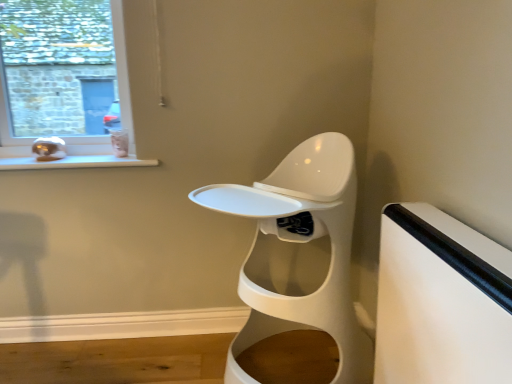
What is the approximate height of white glossy toilet at center?

white glossy toilet at center is 1.09 meters tall.

Measure the distance between point (337, 310) and camera.

Point (337, 310) and camera are 1.36 meters apart.

Image resolution: width=512 pixels, height=384 pixels. What do you see at coordinates (66, 84) in the screenshot?
I see `matte glass window at upper left` at bounding box center [66, 84].

Find the location of a particular element. The width and height of the screenshot is (512, 384). white glossy toilet at center is located at coordinates 298,253.

Measure the distance from white glossy window sill at lower left to white matte table at right.

white glossy window sill at lower left and white matte table at right are 3.68 feet apart.

Between white glossy window sill at lower left and white matte table at right, which one appears on the left side from the viewer's perspective?

Positioned to the left is white glossy window sill at lower left.

Is white glossy window sill at lower left inside the boundaries of white matte table at right, or outside?

white glossy window sill at lower left lies outside white matte table at right.

Can you tell me how much white glossy window sill at lower left and white matte table at right differ in facing direction?

The angle between the facing direction of white glossy window sill at lower left and the facing direction of white matte table at right is 89.7 degrees.

Where is `window above the white matte table at right (from the image's perspective)`? window above the white matte table at right (from the image's perspective) is located at coordinates (66, 84).

Which of these two, matte glass window at upper left or white matte table at right, stands taller?

With more height is matte glass window at upper left.

Is matte glass window at upper left bigger or smaller than white matte table at right?

Clearly, matte glass window at upper left is smaller in size than white matte table at right.

Considering the positions of objects white matte table at right and matte glass window at upper left in the image provided, who is more to the left, white matte table at right or matte glass window at upper left?

matte glass window at upper left is more to the left.

Is white matte table at right in front of or behind matte glass window at upper left in the image?

white matte table at right is in front of matte glass window at upper left.

Considering the positions of points (432, 274) and (24, 119), is point (432, 274) closer to camera compared to point (24, 119)?

Yes.

Is white matte table at right surrounding matte glass window at upper left?

No, matte glass window at upper left is not inside white matte table at right.

Does white glossy window sill at lower left have a greater width compared to matte glass window at upper left?

Correct, the width of white glossy window sill at lower left exceeds that of matte glass window at upper left.

Is white glossy window sill at lower left in front of or behind matte glass window at upper left in the image?

In the image, white glossy window sill at lower left appears in front of matte glass window at upper left.

Does white glossy window sill at lower left have a lesser height compared to matte glass window at upper left?

Yes.

Is point (126, 161) closer or farther from the camera than point (126, 93)?

Point (126, 161) appears to be closer to the viewer than point (126, 93).

From a real-world perspective, is white glossy window sill at lower left located higher than white glossy toilet at center?

Yes, from a real-world perspective, white glossy window sill at lower left is over white glossy toilet at center

How distant is white glossy window sill at lower left from white glossy toilet at center?

white glossy window sill at lower left and white glossy toilet at center are 27.36 inches apart from each other.

Can you tell me how much white glossy window sill at lower left and white glossy toilet at center differ in facing direction?

The angular difference between white glossy window sill at lower left and white glossy toilet at center is 0.473 degrees.

At what (x,y) coordinates should I click in order to perform the action: click on toilet to the right of white glossy window sill at lower left. Please return your answer as a coordinate pair (x, y). The image size is (512, 384). Looking at the image, I should click on tap(298, 253).

Is white glossy toilet at center looking in the opposite direction of matte glass window at upper left?

No, white glossy toilet at center is not facing the opposite direction of matte glass window at upper left.

Between white glossy toilet at center and matte glass window at upper left, which one appears on the right side from the viewer's perspective?

white glossy toilet at center is more to the right.

From a real-world perspective, is white glossy toilet at center on matte glass window at upper left?

No, from a real-world perspective, white glossy toilet at center is not over matte glass window at upper left

Can you tell me how much white glossy toilet at center and matte glass window at upper left differ in facing direction?

There is a 1.87-degree angle between the facing directions of white glossy toilet at center and matte glass window at upper left.

Between white glossy toilet at center and white matte table at right, which one appears on the left side from the viewer's perspective?

Positioned to the left is white glossy toilet at center.

Locate an element on the screen. toilet above the white matte table at right (from a real-world perspective) is located at coordinates (298, 253).

From the image's perspective, does white glossy toilet at center appear lower than white matte table at right?

Incorrect, from the image's perspective, white glossy toilet at center is higher than white matte table at right.

How many degrees apart are the facing directions of white glossy toilet at center and white matte table at right?

90.2 degrees separate the facing orientations of white glossy toilet at center and white matte table at right.

This screenshot has width=512, height=384. I want to click on table below the white glossy window sill at lower left (from a real-world perspective), so click(441, 300).

This screenshot has width=512, height=384. Identify the location of window above the white matte table at right (from a real-world perspective). (66, 84).

When comparing their distances from matte glass window at upper left, does white glossy window sill at lower left or white glossy toilet at center seem further?

white glossy toilet at center.

When comparing their distances from white glossy toilet at center, does matte glass window at upper left or white matte table at right seem further?

matte glass window at upper left lies further to white glossy toilet at center than the other object.

Which object lies further to the anchor point matte glass window at upper left, white matte table at right or white glossy window sill at lower left?

white matte table at right is further to matte glass window at upper left.

Considering their positions, is white glossy toilet at center positioned further to white matte table at right than white glossy window sill at lower left?

Among the two, white glossy window sill at lower left is located further to white matte table at right.

From the image, which object appears to be nearer to white glossy window sill at lower left, white matte table at right or white glossy toilet at center?

white glossy toilet at center is positioned closer to the anchor white glossy window sill at lower left.

From the picture: Looking at the image, which one is located closer to white glossy window sill at lower left, white glossy toilet at center or matte glass window at upper left?

white glossy toilet at center is closer to white glossy window sill at lower left.

Estimate the real-world distances between objects in this image. Which object is closer to white glossy toilet at center, white glossy window sill at lower left or matte glass window at upper left?

white glossy window sill at lower left.

Considering their positions, is white glossy window sill at lower left positioned closer to matte glass window at upper left than white matte table at right?

The object closer to matte glass window at upper left is white glossy window sill at lower left.

Where is `toilet situated between matte glass window at upper left and white matte table at right from left to right`? Image resolution: width=512 pixels, height=384 pixels. toilet situated between matte glass window at upper left and white matte table at right from left to right is located at coordinates (298, 253).

Identify the location of window sill located between matte glass window at upper left and white glossy toilet at center in the left-right direction. (76, 162).

This screenshot has height=384, width=512. Find the location of `toilet situated between white glossy window sill at lower left and white matte table at right from left to right`. toilet situated between white glossy window sill at lower left and white matte table at right from left to right is located at coordinates (298, 253).

You are a GUI agent. You are given a task and a screenshot of the screen. Output one action in this format:
    pyautogui.click(x=<x>, y=<y>)
    Task: Click on the window sill between matte glass window at upper left and white matte table at right from left to right
    
    Given the screenshot: What is the action you would take?
    pyautogui.click(x=76, y=162)